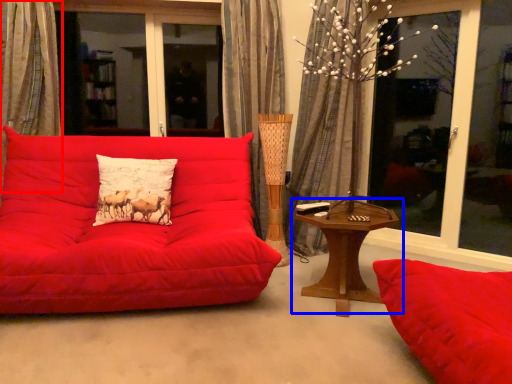
Question: Which point is further to the camera, curtain (highlighted by a red box) or table (highlighted by a blue box)?

Choices:
 (A) curtain
 (B) table

Answer: (A)